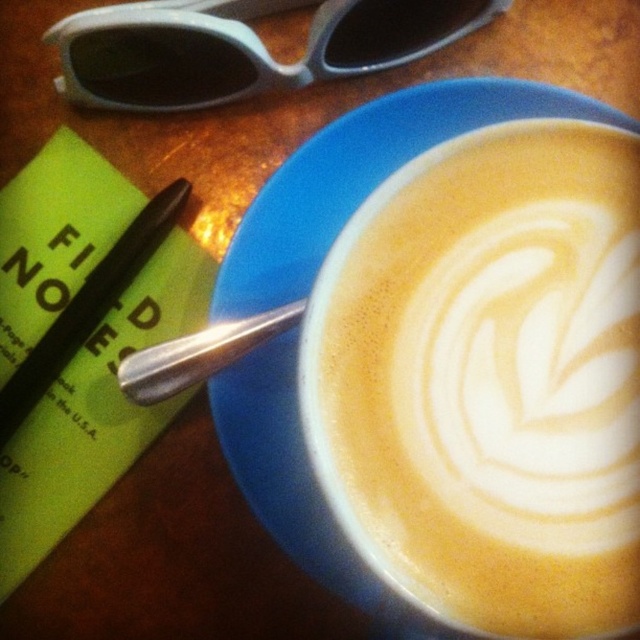
Can you confirm if foamy white coffee at center is smaller than silver metallic spoon at lower left?

No.

Is point (413, 292) positioned in front of point (204, 348)?

Yes, it is in front of point (204, 348).

You are a GUI agent. You are given a task and a screenshot of the screen. Output one action in this format:
    pyautogui.click(x=<x>, y=<y>)
    Task: Click on the foamy white coffee at center
    This screenshot has height=640, width=640.
    Given the screenshot: What is the action you would take?
    pyautogui.click(x=499, y=380)

Which is more to the left, foamy white coffee at center or black matte pen at lower left?

From the viewer's perspective, black matte pen at lower left appears more on the left side.

In the scene shown: Is foamy white coffee at center wider than black matte pen at lower left?

Indeed, foamy white coffee at center has a greater width compared to black matte pen at lower left.

At what (x,y) coordinates should I click in order to perform the action: click on foamy white coffee at center. Please return your answer as a coordinate pair (x, y). Looking at the image, I should click on (499, 380).

At what (x,y) coordinates should I click in order to perform the action: click on matte plastic sunglasses at upper left. Please return your answer as a coordinate pair (x, y). The width and height of the screenshot is (640, 640). Looking at the image, I should click on (241, 45).

Does matte plastic sunglasses at upper left come behind silver metallic spoon at lower left?

That is True.

Find the location of a particular element. This screenshot has height=640, width=640. matte plastic sunglasses at upper left is located at coordinates (241, 45).

Image resolution: width=640 pixels, height=640 pixels. Find the location of `matte plastic sunglasses at upper left`. matte plastic sunglasses at upper left is located at coordinates (241, 45).